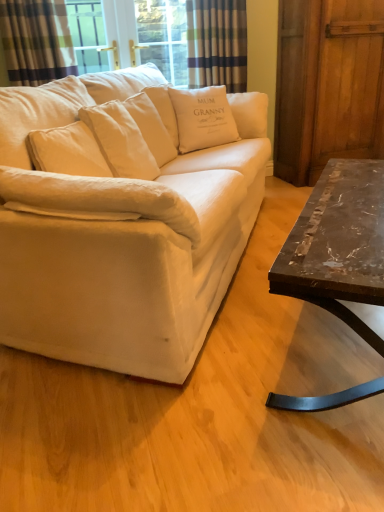
Question: Which is correct: plaid fabric curtain at upper center, the 1th curtain positioned from the right, is inside marble/black metal coffee table at right, or outside of it?

Choices:
 (A) outside
 (B) inside

Answer: (A)

Question: From the image's perspective, is plaid fabric curtain at upper center, the second curtain from the left, located above or below marble/black metal coffee table at right?

Choices:
 (A) above
 (B) below

Answer: (A)

Question: Which is nearer to the plaid fabric curtain at upper left, which is the 1th curtain from front to back?

Choices:
 (A) white cotton cushion at center, the 1th pillow positioned from the left
 (B) marble/black metal coffee table at right
 (C) white cotton cushion at center, which is the 2th pillow from left to right
 (D) wooden barn door at right
 (E) white cotton couch at center

Answer: (A)

Question: Which is farther from the white cotton cushion at center, arranged as the second pillow when viewed from the right?

Choices:
 (A) white cotton couch at center
 (B) marble/black metal coffee table at right
 (C) wooden barn door at right
 (D) plaid fabric curtain at upper center, marked as the second curtain in a front-to-back arrangement
 (E) plaid fabric curtain at upper left, which is the 1th curtain from front to back

Answer: (C)